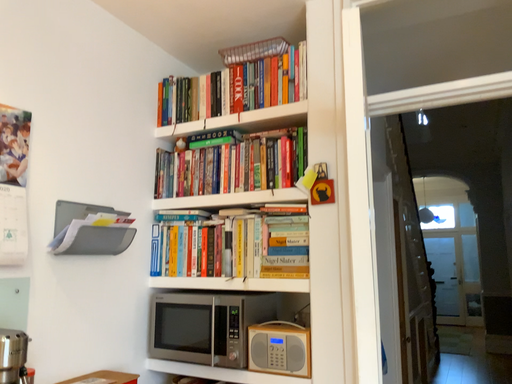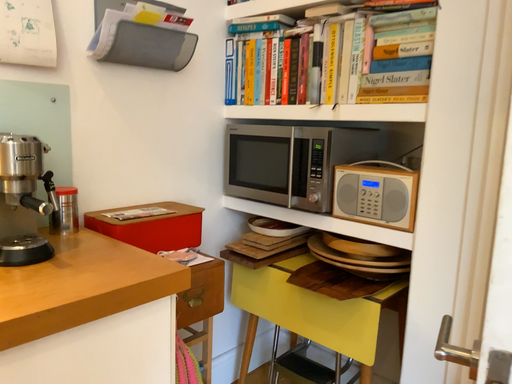
Question: Which way did the camera rotate in the video?

Choices:
 (A) rotated right
 (B) rotated left

Answer: (B)